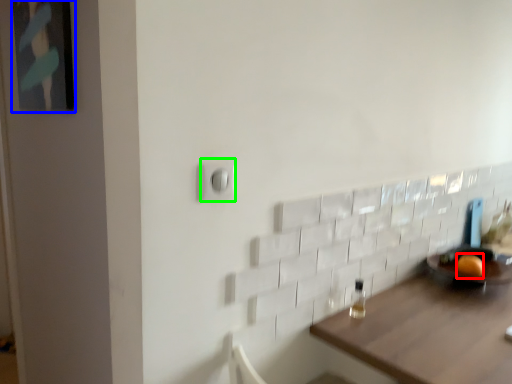
Question: Based on their relative distances, which object is nearer to orange (highlighted by a red box)? Choose from picture frame (highlighted by a blue box) and light switch (highlighted by a green box).

Choices:
 (A) picture frame
 (B) light switch

Answer: (B)